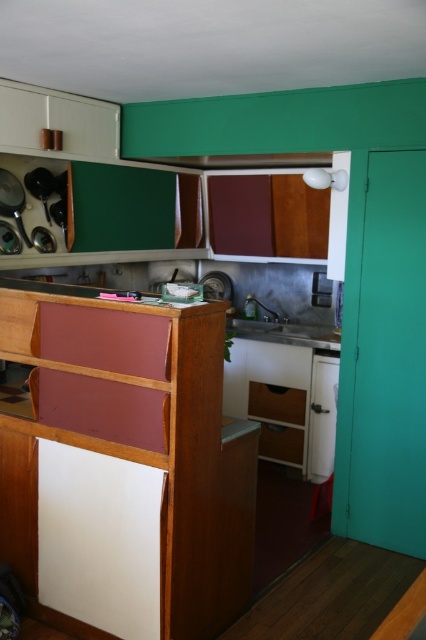
You are standing in the retro kitchen and want to place a new decorative item on the counter. There are two points marked on the counter where you can place it. The first point is at coordinate point(298, 390) and the second is at point(284, 449). According to the image, which point is closer to you?

Point(298, 390) is in front of point(284, 449), so it is closer to you.

You are standing in the kitchen and want to reach the matte wood drawer at center. Based on its 2D coordinates, can you estimate its position relative to the center of the room?

The matte wood drawer at center is located at coordinates approximately 0.630 on the x axis and 0.650 on the y axis, which places it slightly to the right and above the center point of the room.